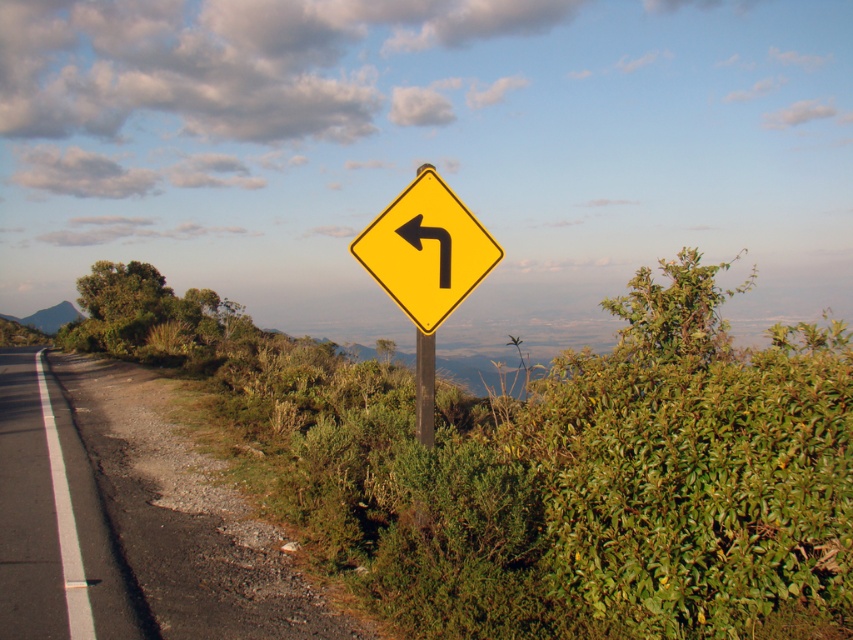
Question: Among these objects, which one is farthest from the camera?

Choices:
 (A) green grassy hill at left
 (B) yellow plastic diamond-shaped road sign at center
 (C) gravel road at left
 (D) metallic pole at center

Answer: (A)

Question: Is gravel road at left below metallic pole at center?

Choices:
 (A) no
 (B) yes

Answer: (B)

Question: Among these points, which one is farthest from the camera?

Choices:
 (A) (428, 337)
 (B) (57, 323)
 (C) (88, 536)

Answer: (B)

Question: Can you confirm if gravel road at left is thinner than black/yellow arrow at center-left?

Choices:
 (A) no
 (B) yes

Answer: (A)

Question: Which of the following is the farthest from the observer?

Choices:
 (A) black/yellow arrow at center-left
 (B) metallic pole at center

Answer: (B)

Question: Does gravel road at left have a greater width compared to black/yellow arrow at center-left?

Choices:
 (A) yes
 (B) no

Answer: (A)